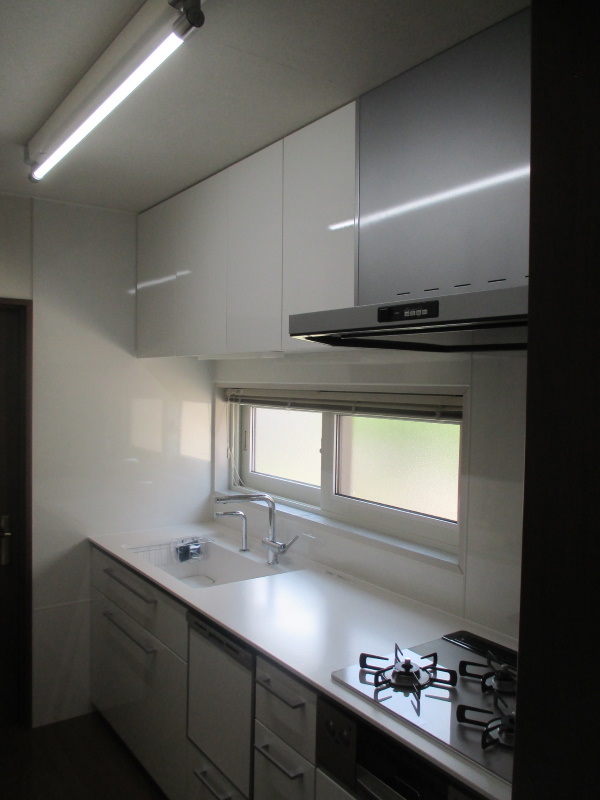
The width and height of the screenshot is (600, 800). I want to click on floor, so click(81, 752).